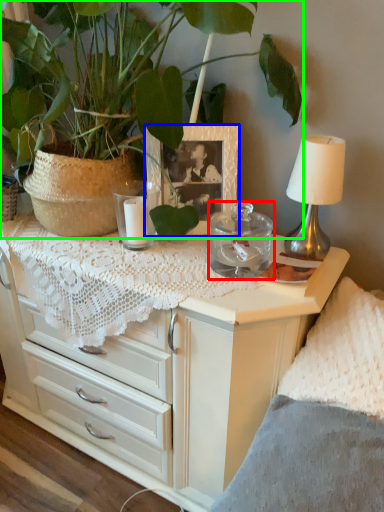
Question: Based on their relative distances, which object is nearer to candle holder (highlighted by a red box)? Choose from picture frame (highlighted by a blue box) and houseplant (highlighted by a green box).

Choices:
 (A) picture frame
 (B) houseplant

Answer: (A)